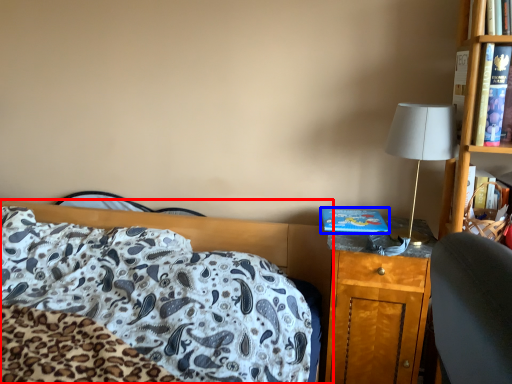
Question: Among these objects, which one is farthest to the camera, bed (highlighted by a red box) or hardback book (highlighted by a blue box)?

Choices:
 (A) bed
 (B) hardback book

Answer: (B)